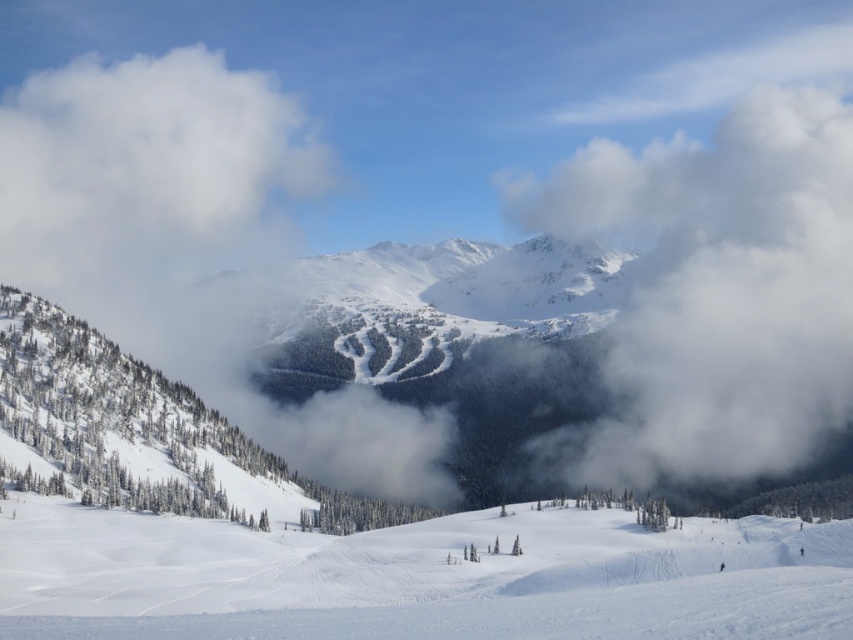
Question: Which point is farther to the camera?

Choices:
 (A) (666, 248)
 (B) (149, 170)

Answer: (B)

Question: Estimate the real-world distances between objects in this image. Which object is farther from the white snow ski slope at lower center?

Choices:
 (A) white fluffy cloud at upper right
 (B) white fluffy cloud at upper left

Answer: (B)

Question: Is white snow ski slope at lower center to the left of white fluffy cloud at upper right from the viewer's perspective?

Choices:
 (A) no
 (B) yes

Answer: (B)

Question: Is white snow ski slope at lower center thinner than white fluffy cloud at upper right?

Choices:
 (A) no
 (B) yes

Answer: (B)

Question: Is white snow ski slope at lower center bigger than white fluffy cloud at upper left?

Choices:
 (A) yes
 (B) no

Answer: (B)

Question: Which object is closer to the camera taking this photo?

Choices:
 (A) white fluffy cloud at upper left
 (B) white snow ski slope at lower center
 (C) white fluffy cloud at upper right

Answer: (B)